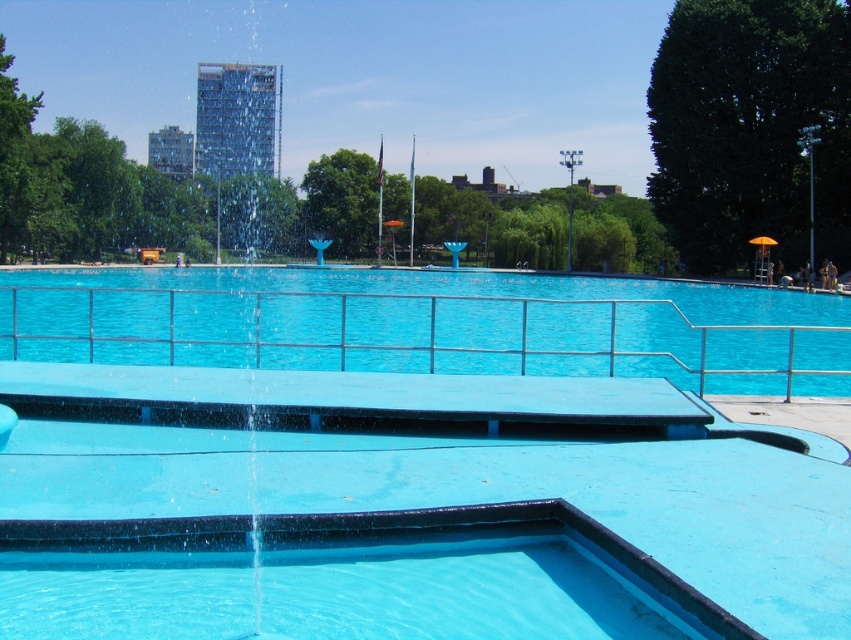
Based on the photo, is smooth blue pool at center in front of blue rubber pool at center?

Yes, it is in front of blue rubber pool at center.

Find the location of a particular element. This screenshot has width=851, height=640. smooth blue pool at center is located at coordinates (407, 508).

Which is in front, point (763, 454) or point (697, 314)?

Point (763, 454) is more forward.

The height and width of the screenshot is (640, 851). What are the coordinates of `smooth blue pool at center` in the screenshot? It's located at (407, 508).